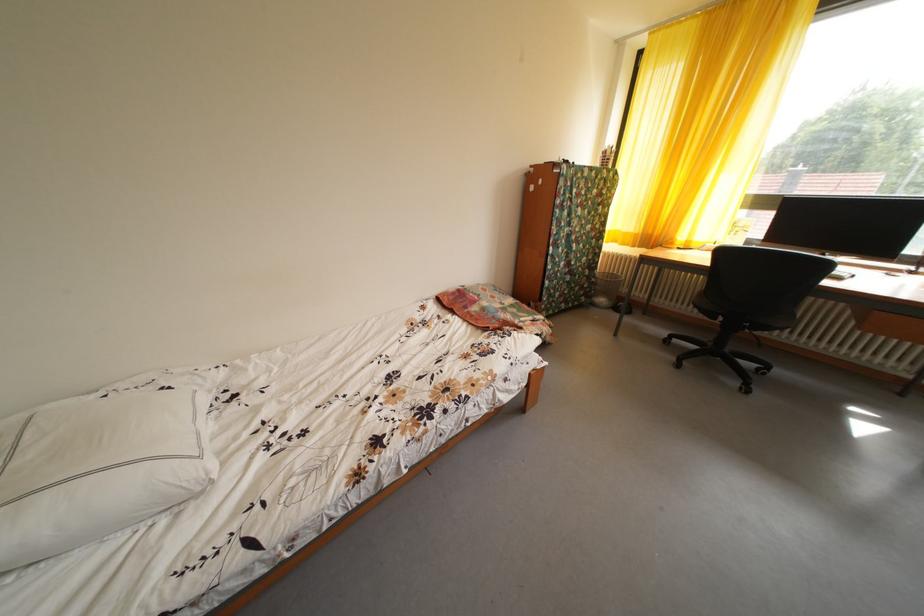
Describe the element at coordinates (98, 467) in the screenshot. I see `a white bed pillow` at that location.